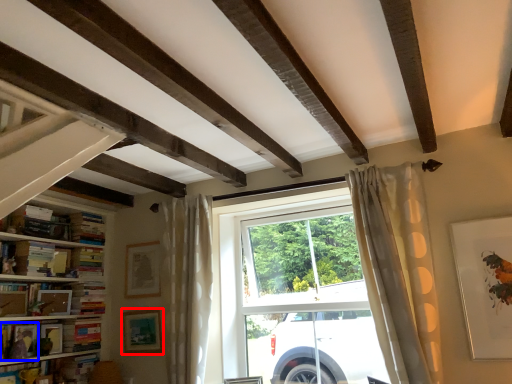
Question: Which object appears farthest to the camera in this image, picture frame (highlighted by a red box) or book (highlighted by a blue box)?

Choices:
 (A) picture frame
 (B) book

Answer: (A)